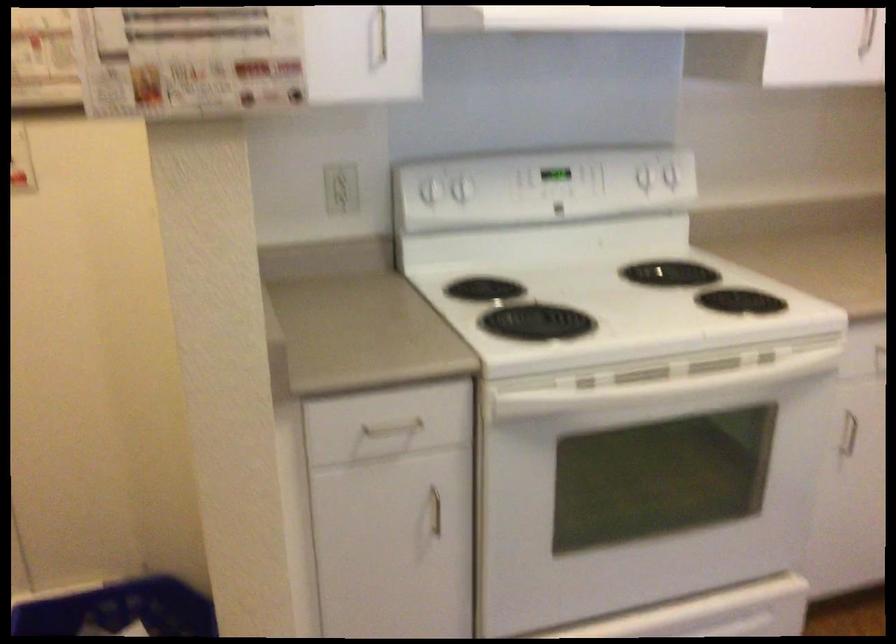
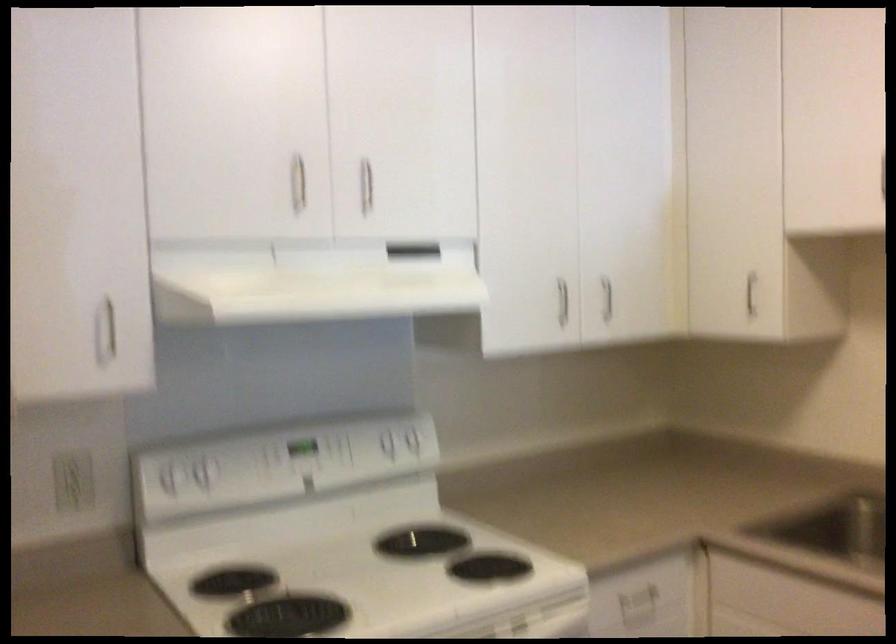
Locate, in the second image, the point that corresponds to point 642,169 in the first image.

(385, 440)